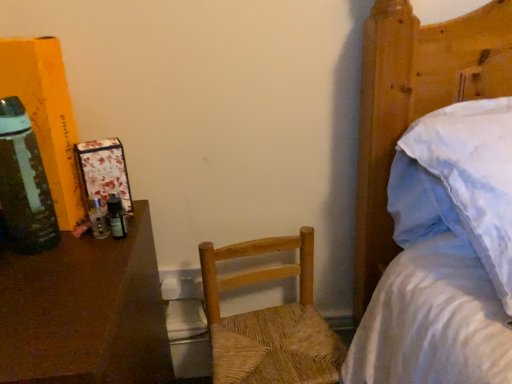
What are the coordinates of `free location above brown polished wood desk at left (from a real-world perspective)` in the screenshot? It's located at (47, 275).